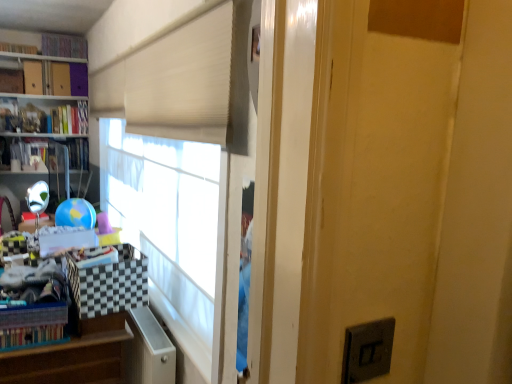
Where is `multicolored fabric book at upper left, which is the fourth book from bottom to top`? The width and height of the screenshot is (512, 384). multicolored fabric book at upper left, which is the fourth book from bottom to top is located at coordinates (64, 46).

This screenshot has height=384, width=512. Find the location of `wooden at left`. wooden at left is located at coordinates (72, 358).

The height and width of the screenshot is (384, 512). What are the coordinates of `hardcover book at left, the 1th book from the bottom` in the screenshot? It's located at (77, 152).

Identify the location of multicolored fabric book at upper left, which is the fourth book from bottom to top. This screenshot has width=512, height=384. [64, 46].

Is white plastic file cabinet at lower left to the right of multicolored fabric book at upper left, which is the fourth book from bottom to top, from the viewer's perspective?

Indeed, white plastic file cabinet at lower left is positioned on the right side of multicolored fabric book at upper left, which is the fourth book from bottom to top.

From a real-world perspective, is white plastic file cabinet at lower left on top of multicolored fabric book at upper left, which is the fourth book from bottom to top?

Actually, white plastic file cabinet at lower left is physically below multicolored fabric book at upper left, which is the fourth book from bottom to top, in the real world.

Looking at this image, how different are the orientations of white plastic file cabinet at lower left and multicolored fabric book at upper left, which is the fourth book from bottom to top, in degrees?

There is a 90.6-degree angle between the facing directions of white plastic file cabinet at lower left and multicolored fabric book at upper left, which is the fourth book from bottom to top.

Where is `file cabinet below the multicolored fabric book at upper left, which appears as the 1th book when viewed from the top (from a real-world perspective)`? The height and width of the screenshot is (384, 512). file cabinet below the multicolored fabric book at upper left, which appears as the 1th book when viewed from the top (from a real-world perspective) is located at coordinates (149, 350).

Is hardcover book at left, the 1th book from the bottom, positioned with its back to hardcover book at upper left, the third book positioned from the bottom?

No, hardcover book at left, the 1th book from the bottom, is not facing away from hardcover book at upper left, the third book positioned from the bottom.

Is hardcover book at left, which is counted as the fourth book, starting from the top, placed right next to hardcover book at upper left, which is the 2th book from top to bottom?

They are not placed beside each other.

Considering the sizes of objects hardcover book at left, which is counted as the fourth book, starting from the top, and hardcover book at upper left, which is the 2th book from top to bottom, in the image provided, who is wider, hardcover book at left, which is counted as the fourth book, starting from the top, or hardcover book at upper left, which is the 2th book from top to bottom,?

A: With larger width is hardcover book at left, which is counted as the fourth book, starting from the top.

Is hardcover book at left, the 1th book from the bottom, smaller than hardcover book at upper left, which is the 2th book from top to bottom?

No.

Is white plastic file cabinet at lower left looking in the opposite direction of hardcover book at upper left, the third book positioned from the bottom?

No, white plastic file cabinet at lower left is not facing away from hardcover book at upper left, the third book positioned from the bottom.

Can you see white plastic file cabinet at lower left touching hardcover book at upper left, the third book positioned from the bottom?

No, white plastic file cabinet at lower left is not touching hardcover book at upper left, the third book positioned from the bottom.

Is point (129, 324) farther from camera compared to point (8, 45)?

No, (129, 324) is closer to viewer.

Is white plastic file cabinet at lower left to the left of hardcover book at upper left, which is the 2th book from top to bottom, from the viewer's perspective?

Incorrect, white plastic file cabinet at lower left is not on the left side of hardcover book at upper left, which is the 2th book from top to bottom.

Which is more to the right, white plastic file cabinet at lower left or hardcover book at upper left, marked as the third book in a top-to-bottom arrangement?

Positioned to the right is white plastic file cabinet at lower left.

Considering their positions, is white plastic file cabinet at lower left located in front of or behind hardcover book at upper left, marked as the third book in a top-to-bottom arrangement?

Visually, white plastic file cabinet at lower left is located in front of hardcover book at upper left, marked as the third book in a top-to-bottom arrangement.

Does point (153, 342) lie behind point (86, 123)?

No.

Is white plastic file cabinet at lower left oriented towards hardcover book at upper left, acting as the second book starting from the bottom?

No, white plastic file cabinet at lower left does not turn towards hardcover book at upper left, acting as the second book starting from the bottom.

Considering the positions of objects hardcover book at left, the 1th book from the bottom, and hardcover book at upper left, marked as the third book in a top-to-bottom arrangement, in the image provided, who is more to the left, hardcover book at left, the 1th book from the bottom, or hardcover book at upper left, marked as the third book in a top-to-bottom arrangement,?

hardcover book at left, the 1th book from the bottom, is more to the left.

Is hardcover book at left, the 1th book from the bottom, oriented towards hardcover book at upper left, marked as the third book in a top-to-bottom arrangement?

No, hardcover book at left, the 1th book from the bottom, is not turned towards hardcover book at upper left, marked as the third book in a top-to-bottom arrangement.

How distant is hardcover book at left, the 1th book from the bottom, from hardcover book at upper left, acting as the second book starting from the bottom?

hardcover book at left, the 1th book from the bottom, is 9.05 inches away from hardcover book at upper left, acting as the second book starting from the bottom.

Could you measure the distance between hardcover book at upper left, acting as the second book starting from the bottom, and white plastic file cabinet at lower left?

hardcover book at upper left, acting as the second book starting from the bottom, is 2.63 meters away from white plastic file cabinet at lower left.

Where is `file cabinet directly beneath the hardcover book at upper left, acting as the second book starting from the bottom (from a real-world perspective)`? The image size is (512, 384). file cabinet directly beneath the hardcover book at upper left, acting as the second book starting from the bottom (from a real-world perspective) is located at coordinates (149, 350).

In terms of height, does hardcover book at upper left, marked as the third book in a top-to-bottom arrangement, look taller or shorter compared to white plastic file cabinet at lower left?

Clearly, hardcover book at upper left, marked as the third book in a top-to-bottom arrangement, is shorter compared to white plastic file cabinet at lower left.

From a real-world perspective, is hardcover book at upper left, marked as the third book in a top-to-bottom arrangement, over white plastic file cabinet at lower left?

Correct, in the physical world, hardcover book at upper left, marked as the third book in a top-to-bottom arrangement, is higher than white plastic file cabinet at lower left.

How many degrees apart are the facing directions of wooden at left and hardcover book at left, the 1th book from the bottom?

93.1 degrees.

Can you confirm if wooden at left is bigger than hardcover book at left, which is counted as the fourth book, starting from the top?

Indeed, wooden at left has a larger size compared to hardcover book at left, which is counted as the fourth book, starting from the top.

Is wooden at left at the right side of hardcover book at left, which is counted as the fourth book, starting from the top?

Correct, you'll find wooden at left to the right of hardcover book at left, which is counted as the fourth book, starting from the top.

Considering the sizes of wooden at left and hardcover book at left, the 1th book from the bottom, in the image, is wooden at left taller or shorter than hardcover book at left, the 1th book from the bottom,?

Clearly, wooden at left is taller compared to hardcover book at left, the 1th book from the bottom.

At what (x,y) coordinates should I click in order to perform the action: click on book that is the 4th one when counting upward from the white plastic file cabinet at lower left (from the image's perspective). Please return your answer as a coordinate pair (x, y). The width and height of the screenshot is (512, 384). Looking at the image, I should click on (64, 46).

Identify the location of book that is the 2nd object directly below the hardcover book at upper left, the third book positioned from the bottom (from a real-world perspective). This screenshot has height=384, width=512. (77, 152).

From the image, which object appears to be nearer to hardcover book at left, the 1th book from the bottom, hardcover book at upper left, which is the 2th book from top to bottom, or multicolored fabric book at upper left, which is the fourth book from bottom to top?

multicolored fabric book at upper left, which is the fourth book from bottom to top, lies closer to hardcover book at left, the 1th book from the bottom, than the other object.

Looking at the image, which one is located closer to hardcover book at upper left, which is the 2th book from top to bottom, matte purple bookcase at upper left or white plastic file cabinet at lower left?

matte purple bookcase at upper left.

From the image, which object appears to be nearer to multicolored fabric book at upper left, which appears as the 1th book when viewed from the top, matte purple bookcase at upper left or hardcover book at upper left, the third book positioned from the bottom?

Based on the image, matte purple bookcase at upper left appears to be nearer to multicolored fabric book at upper left, which appears as the 1th book when viewed from the top.

Estimate the real-world distances between objects in this image. Which object is closer to hardcover book at upper left, which is the 2th book from top to bottom, white plastic file cabinet at lower left or hardcover book at upper left, marked as the third book in a top-to-bottom arrangement?

hardcover book at upper left, marked as the third book in a top-to-bottom arrangement.

From the image, which object appears to be farther from wooden at left, hardcover book at upper left, marked as the third book in a top-to-bottom arrangement, or multicolored fabric book at upper left, which is the fourth book from bottom to top?

The object further to wooden at left is multicolored fabric book at upper left, which is the fourth book from bottom to top.

Considering their positions, is multicolored fabric book at upper left, which is the fourth book from bottom to top, positioned further to hardcover book at upper left, which is the 2th book from top to bottom, than hardcover book at left, the 1th book from the bottom?

hardcover book at left, the 1th book from the bottom, is positioned further to the anchor hardcover book at upper left, which is the 2th book from top to bottom.

In the scene shown: From the image, which object appears to be farther from white plastic file cabinet at lower left, hardcover book at upper left, acting as the second book starting from the bottom, or multicolored fabric book at upper left, which appears as the 1th book when viewed from the top?

Among the two, multicolored fabric book at upper left, which appears as the 1th book when viewed from the top, is located further to white plastic file cabinet at lower left.

Considering their positions, is white plastic file cabinet at lower left positioned further to multicolored fabric book at upper left, which appears as the 1th book when viewed from the top, than hardcover book at left, which is counted as the fourth book, starting from the top?

white plastic file cabinet at lower left is positioned further to the anchor multicolored fabric book at upper left, which appears as the 1th book when viewed from the top.

Locate an element on the screen. The width and height of the screenshot is (512, 384). book between multicolored fabric book at upper left, which appears as the 1th book when viewed from the top, and hardcover book at upper left, acting as the second book starting from the bottom, from top to bottom is located at coordinates (18, 48).

In order to click on bookcase between white plastic file cabinet at lower left and hardcover book at left, the 1th book from the bottom, from front to back in this screenshot , I will do `click(50, 74)`.

Find the location of a particular element. The width and height of the screenshot is (512, 384). bookcase positioned between wooden at left and multicolored fabric book at upper left, which appears as the 1th book when viewed from the top, from near to far is located at coordinates (50, 74).

The image size is (512, 384). In order to click on file cabinet between multicolored fabric book at upper left, which is the fourth book from bottom to top, and wooden at left, in the vertical direction in this screenshot , I will do `click(149, 350)`.